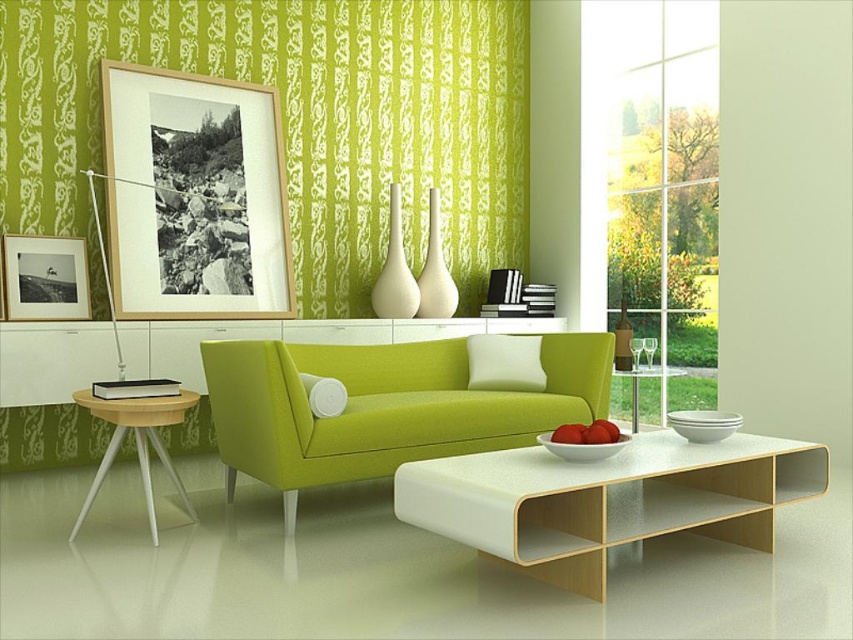
You are arranging a party in the living room and need to place a large centerpiece between the white glossy table at center and the metallic silver side table at center. Based on their positions, which table should the centerpiece be placed closer to?

The white glossy table at center is to the left of the metallic silver side table at center, so the centerpiece should be placed closer to the metallic silver side table at center to maintain symmetry between the two tables.

You are standing in the living room and want to place a new painting on the wall. The existing wooden picture frame at upper left is represented by point (194, 196). Where should you place the new painting to ensure it is not too close to the existing one?

The wooden picture frame at upper left is represented by point (194, 196). To avoid placing the new painting too close, choose a location that is at least 0.1 units away in either the x or y coordinate.

You are standing in the living room and want to place a new potted plant at point (397, 451). The plant is 10 feet tall. Will it fit without touching the ceiling?

The distance of point (397, 451) from the camera is 9.87 feet. Since the plant is 10 feet tall, it will likely touch or exceed the ceiling height, so it may not fit properly.